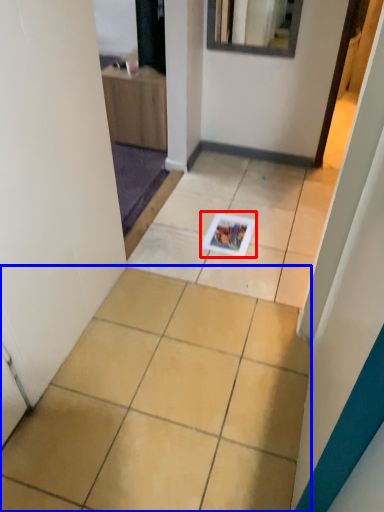
Question: Which point is further to the camera, magazine (highlighted by a red box) or ceramic tile (highlighted by a blue box)?

Choices:
 (A) magazine
 (B) ceramic tile

Answer: (A)